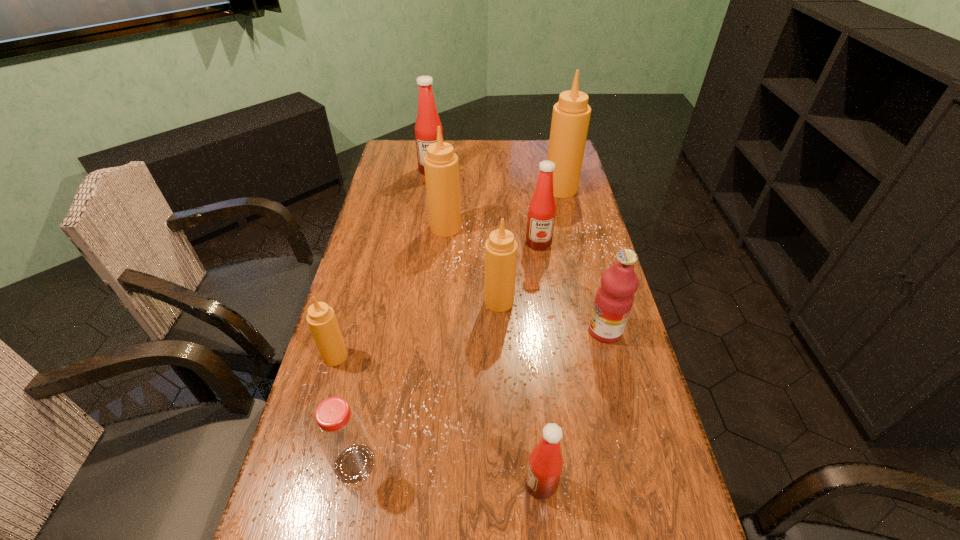
Identify the location of fruit juice. (614, 299).

Where is `the smallest tan condiment`? Image resolution: width=960 pixels, height=540 pixels. the smallest tan condiment is located at coordinates (321, 318).

Locate an element on the screen. the leftmost tan condiment is located at coordinates (321, 318).

This screenshot has width=960, height=540. I want to click on the smallest red condiment, so click(x=545, y=465).

Locate an element on the screen. Image resolution: width=960 pixels, height=540 pixels. the nearest condiment is located at coordinates (545, 465).

Locate an element on the screen. The height and width of the screenshot is (540, 960). bottle is located at coordinates (342, 436).

Where is `vacant space located 0.190m on the left of the tallest object`? The width and height of the screenshot is (960, 540). vacant space located 0.190m on the left of the tallest object is located at coordinates (495, 189).

Find the location of `free point located on the front-facing side of the farthest object`. free point located on the front-facing side of the farthest object is located at coordinates (422, 233).

Where is `vacant space situated on the back of the third tan condiment from right to left`? Image resolution: width=960 pixels, height=540 pixels. vacant space situated on the back of the third tan condiment from right to left is located at coordinates (450, 177).

Identify the location of free spot located on the front of the third farthest tan condiment. (504, 419).